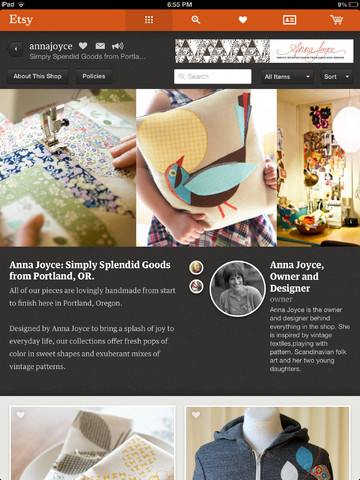
Identify the location of curtain. The height and width of the screenshot is (480, 360). (313, 416).